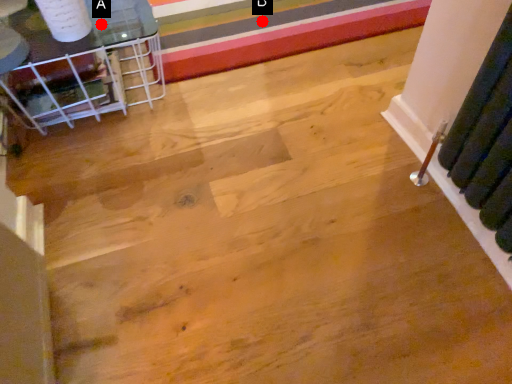
Question: Two points are circled on the image, labeled by A and B beside each circle. Which point is closer to the camera?

Choices:
 (A) A is closer
 (B) B is closer

Answer: (A)